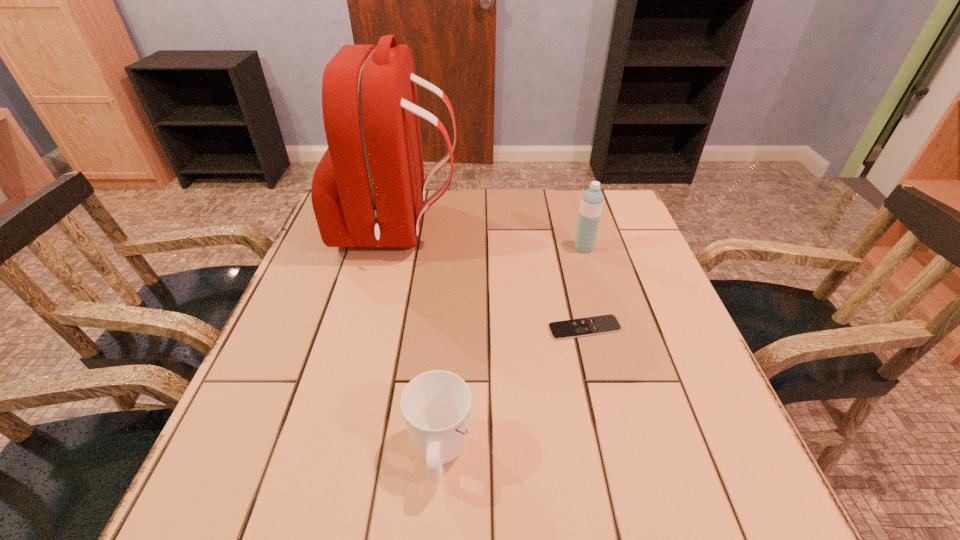
You are a GUI agent. You are given a task and a screenshot of the screen. Output one action in this format:
    pyautogui.click(x=<x>, y=<y>)
    Task: Click on the vacant space that satisfies the following two spatial constraints: 1. on the side of the mug with the handle; 2. on the strap side of the tallest object
    This screenshot has height=540, width=960.
    Given the screenshot: What is the action you would take?
    coord(456,230)

Where is `vacant space that satisfies the following two spatial constraints: 1. on the strap side of the water bottle; 2. on the left side of the backpack`? The image size is (960, 540). vacant space that satisfies the following two spatial constraints: 1. on the strap side of the water bottle; 2. on the left side of the backpack is located at coordinates (395, 248).

Locate an element on the screen. The width and height of the screenshot is (960, 540). vacant space that satisfies the following two spatial constraints: 1. on the side of the second shortest object with the handle; 2. on the left side of the remote control is located at coordinates (449, 328).

Find the location of a particular element. The image size is (960, 540). vacant region that satisfies the following two spatial constraints: 1. on the back side of the remote control; 2. on the right side of the water bottle is located at coordinates pyautogui.click(x=565, y=248).

Identify the location of free spot that satisfies the following two spatial constraints: 1. on the strap side of the tallest object; 2. on the side of the nearest object with the handle. (345, 454).

Where is `vacant space that satisfies the following two spatial constraints: 1. on the side of the nearest object with the handle; 2. on the strap side of the backpack`? This screenshot has height=540, width=960. vacant space that satisfies the following two spatial constraints: 1. on the side of the nearest object with the handle; 2. on the strap side of the backpack is located at coordinates (456, 230).